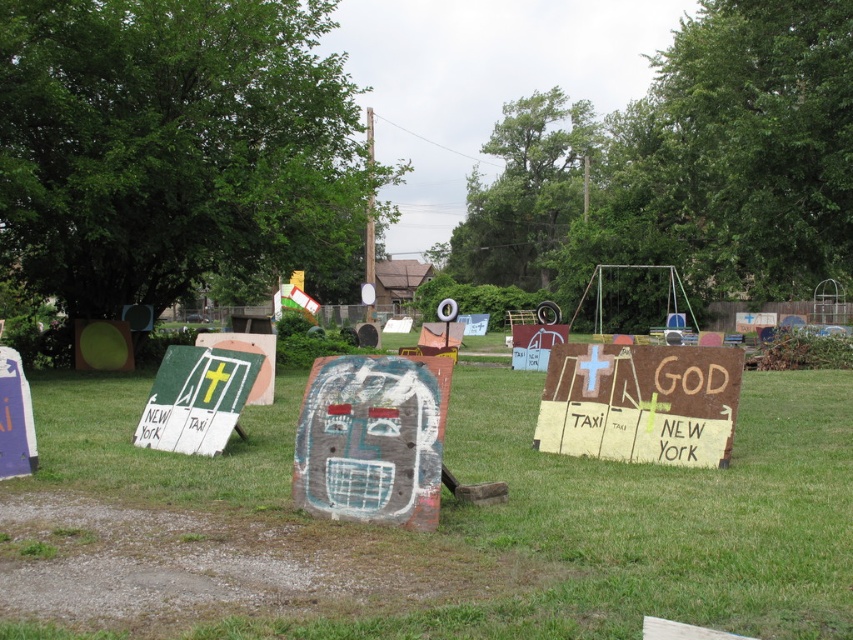
Question: Does green grass at center have a lesser width compared to rusty wood sign at center?

Choices:
 (A) yes
 (B) no

Answer: (B)

Question: Which of the following is the closest to the observer?

Choices:
 (A) (196, 376)
 (B) (575, 444)

Answer: (B)

Question: Which object is the farthest from the green felt sign at center?

Choices:
 (A) rusty metal sign at center
 (B) rusty wood sign at center
 (C) green grass at center

Answer: (A)

Question: Does rusty wood sign at center have a larger size compared to green felt sign at center?

Choices:
 (A) no
 (B) yes

Answer: (A)

Question: Observing the image, what is the correct spatial positioning of green grass at center in reference to rusty metal sign at center?

Choices:
 (A) left
 (B) right

Answer: (A)

Question: Which is farther from the rusty metal sign at center?

Choices:
 (A) green grass at center
 (B) green felt sign at center
 (C) rusty wood sign at center

Answer: (B)